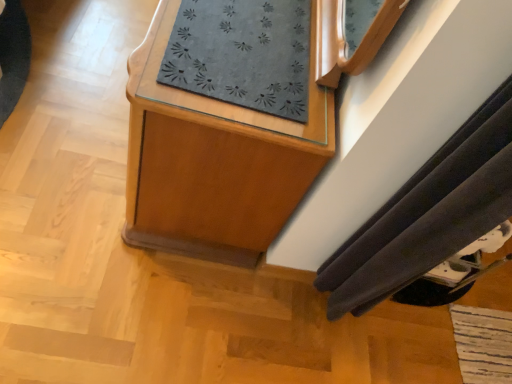
You are a GUI agent. You are given a task and a screenshot of the screen. Output one action in this format:
    pyautogui.click(x=<x>, y=<y>)
    Task: Click on the free space above wooden cabinet at center (from a real-world perspective)
    
    Given the screenshot: What is the action you would take?
    tap(245, 36)